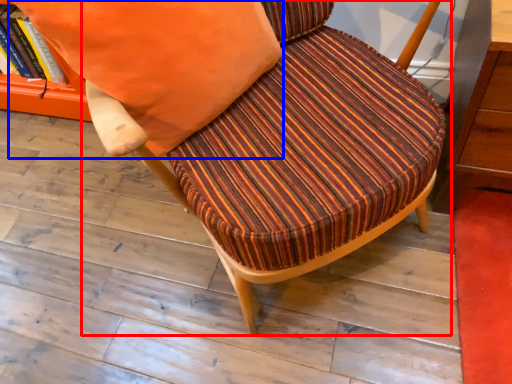
Question: Which point is further to the camera, chair (highlighted by a red box) or throw pillow (highlighted by a blue box)?

Choices:
 (A) chair
 (B) throw pillow

Answer: (B)